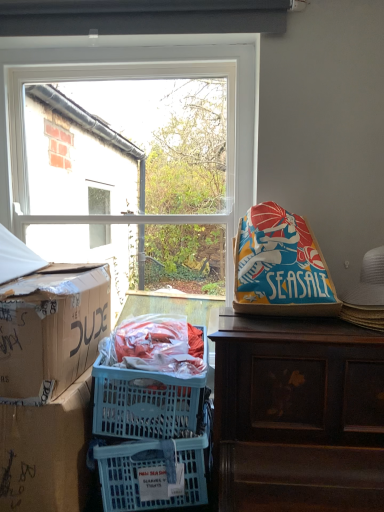
What do you see at coordinates (298, 415) in the screenshot? I see `brown wooden desk at upper right` at bounding box center [298, 415].

What do you see at coordinates (51, 330) in the screenshot?
I see `cardboard box at left, acting as the 2th box starting from the bottom` at bounding box center [51, 330].

The image size is (384, 512). What do you see at coordinates (46, 452) in the screenshot?
I see `cardboard box at left, arranged as the 1th box when ordered from the bottom` at bounding box center [46, 452].

This screenshot has width=384, height=512. I want to click on cardboard box at left, arranged as the 1th box when ordered from the bottom, so click(x=46, y=452).

Where is `blue fabric bean bag at right`? blue fabric bean bag at right is located at coordinates (280, 266).

Is clear glass window at upper center completely or partially outside of brown wooden desk at upper right?

That's correct, clear glass window at upper center is outside of brown wooden desk at upper right.

In the scene shown: Considering the relative sizes of clear glass window at upper center and brown wooden desk at upper right in the image provided, is clear glass window at upper center wider than brown wooden desk at upper right?

No.

From a real-world perspective, is clear glass window at upper center physically located above or below brown wooden desk at upper right?

From a real-world perspective, clear glass window at upper center is physically above brown wooden desk at upper right.

Is clear glass window at upper center smaller than brown wooden desk at upper right?

Correct, clear glass window at upper center occupies less space than brown wooden desk at upper right.

Between point (11, 324) and point (288, 258), which one is positioned behind?

The point (288, 258) is more distant.

How distant is cardboard box at left, positioned as the 1th box in top-to-bottom order, from blue fabric bean bag at right?

cardboard box at left, positioned as the 1th box in top-to-bottom order, is 24.65 inches from blue fabric bean bag at right.

Considering the sizes of objects cardboard box at left, acting as the 2th box starting from the bottom, and blue fabric bean bag at right in the image provided, who is bigger, cardboard box at left, acting as the 2th box starting from the bottom, or blue fabric bean bag at right?

cardboard box at left, acting as the 2th box starting from the bottom, is bigger.

In the image, is blue fabric bean bag at right on the left side or the right side of brown wooden desk at upper right?

blue fabric bean bag at right is positioned on brown wooden desk at upper right's left side.

Between blue fabric bean bag at right and brown wooden desk at upper right, which one has less height?

With less height is blue fabric bean bag at right.

What are the coordinates of `desk directly beneath the blue fabric bean bag at right (from a real-world perspective)` in the screenshot? It's located at (x=298, y=415).

Does point (291, 447) lie in front of point (73, 284)?

Yes, it is.

Is cardboard box at left, positioned as the 1th box in top-to-bottom order, at the back of brown wooden desk at upper right?

brown wooden desk at upper right does not have its back to cardboard box at left, positioned as the 1th box in top-to-bottom order.

From the image's perspective, is brown wooden desk at upper right on top of cardboard box at left, positioned as the 1th box in top-to-bottom order?

Actually, brown wooden desk at upper right appears below cardboard box at left, positioned as the 1th box in top-to-bottom order, in the image.

Is brown wooden desk at upper right in contact with cardboard box at left, positioned as the 1th box in top-to-bottom order?

No, brown wooden desk at upper right is not next to cardboard box at left, positioned as the 1th box in top-to-bottom order.

Looking at this image, from the image's perspective, is clear glass window at upper center under cardboard box at left, arranged as the 1th box when ordered from the bottom?

No, from the image's perspective, clear glass window at upper center is not below cardboard box at left, arranged as the 1th box when ordered from the bottom.

Is the depth of clear glass window at upper center less than that of cardboard box at left, acting as the 2th box starting from the top?

No, clear glass window at upper center is further to the viewer.

Considering the sizes of objects clear glass window at upper center and cardboard box at left, acting as the 2th box starting from the top, in the image provided, who is wider, clear glass window at upper center or cardboard box at left, acting as the 2th box starting from the top,?

With larger width is cardboard box at left, acting as the 2th box starting from the top.

Based on the photo, considering the sizes of objects clear glass window at upper center and cardboard box at left, arranged as the 1th box when ordered from the bottom, in the image provided, who is bigger, clear glass window at upper center or cardboard box at left, arranged as the 1th box when ordered from the bottom,?

With larger size is clear glass window at upper center.

In the scene shown: Which is more to the right, blue fabric bean bag at right or cardboard box at left, acting as the 2th box starting from the bottom?

Positioned to the right is blue fabric bean bag at right.

Is blue fabric bean bag at right facing towards cardboard box at left, acting as the 2th box starting from the bottom?

No, blue fabric bean bag at right is not aimed at cardboard box at left, acting as the 2th box starting from the bottom.

Who is shorter, blue fabric bean bag at right or cardboard box at left, acting as the 2th box starting from the bottom?

With less height is blue fabric bean bag at right.

Is the surface of cardboard box at left, acting as the 2th box starting from the top, in direct contact with clear glass window at upper center?

No.

Considering the sizes of objects cardboard box at left, arranged as the 1th box when ordered from the bottom, and clear glass window at upper center in the image provided, who is bigger, cardboard box at left, arranged as the 1th box when ordered from the bottom, or clear glass window at upper center?

clear glass window at upper center.

Based on the photo, is clear glass window at upper center a part of cardboard box at left, acting as the 2th box starting from the top?

No, clear glass window at upper center is not a part of cardboard box at left, acting as the 2th box starting from the top.

At what (x,y) coordinates should I click in order to perform the action: click on window above the cardboard box at left, arranged as the 1th box when ordered from the bottom (from the image's perspective). Please return your answer as a coordinate pair (x, y). Looking at the image, I should click on (140, 78).

Locate an element on the screen. The image size is (384, 512). desk below the clear glass window at upper center (from the image's perspective) is located at coordinates (x=298, y=415).

There is a cardboard box at left, acting as the 2th box starting from the bottom. Identify the location of bean bag chair above it (from a real-world perspective). (280, 266).

Which object lies nearer to the anchor point cardboard box at left, acting as the 2th box starting from the top, brown wooden desk at upper right or cardboard box at left, positioned as the 1th box in top-to-bottom order?

cardboard box at left, positioned as the 1th box in top-to-bottom order, is closer to cardboard box at left, acting as the 2th box starting from the top.

From the image, which object appears to be nearer to blue fabric bean bag at right, cardboard box at left, positioned as the 1th box in top-to-bottom order, or cardboard box at left, arranged as the 1th box when ordered from the bottom?

cardboard box at left, positioned as the 1th box in top-to-bottom order, lies closer to blue fabric bean bag at right than the other object.

Considering their positions, is brown wooden desk at upper right positioned closer to blue fabric bean bag at right than clear glass window at upper center?

The object closer to blue fabric bean bag at right is brown wooden desk at upper right.

Considering their positions, is cardboard box at left, acting as the 2th box starting from the top, positioned closer to blue fabric bean bag at right than brown wooden desk at upper right?

brown wooden desk at upper right is closer to blue fabric bean bag at right.

Looking at the image, which one is located closer to cardboard box at left, positioned as the 1th box in top-to-bottom order, cardboard box at left, acting as the 2th box starting from the top, or brown wooden desk at upper right?

Among the two, cardboard box at left, acting as the 2th box starting from the top, is located nearer to cardboard box at left, positioned as the 1th box in top-to-bottom order.

From the image, which object appears to be farther from cardboard box at left, acting as the 2th box starting from the top, brown wooden desk at upper right or blue fabric bean bag at right?

blue fabric bean bag at right is further to cardboard box at left, acting as the 2th box starting from the top.

Which object lies further to the anchor point clear glass window at upper center, cardboard box at left, acting as the 2th box starting from the bottom, or blue fabric bean bag at right?

Based on the image, cardboard box at left, acting as the 2th box starting from the bottom, appears to be further to clear glass window at upper center.

Based on their spatial positions, is clear glass window at upper center or cardboard box at left, acting as the 2th box starting from the top, further from cardboard box at left, acting as the 2th box starting from the bottom?

Based on the image, clear glass window at upper center appears to be further to cardboard box at left, acting as the 2th box starting from the bottom.

This screenshot has height=512, width=384. I want to click on window located between cardboard box at left, acting as the 2th box starting from the bottom, and blue fabric bean bag at right in the left-right direction, so [x=140, y=78].

Where is `box that lies between clear glass window at upper center and brown wooden desk at upper right from top to bottom`? box that lies between clear glass window at upper center and brown wooden desk at upper right from top to bottom is located at coordinates (51, 330).

The image size is (384, 512). Find the location of `bean bag chair located between cardboard box at left, positioned as the 1th box in top-to-bottom order, and brown wooden desk at upper right in the left-right direction`. bean bag chair located between cardboard box at left, positioned as the 1th box in top-to-bottom order, and brown wooden desk at upper right in the left-right direction is located at coordinates (280, 266).

Locate an element on the screen. Image resolution: width=384 pixels, height=512 pixels. bean bag chair between clear glass window at upper center and brown wooden desk at upper right in the up-down direction is located at coordinates [280, 266].